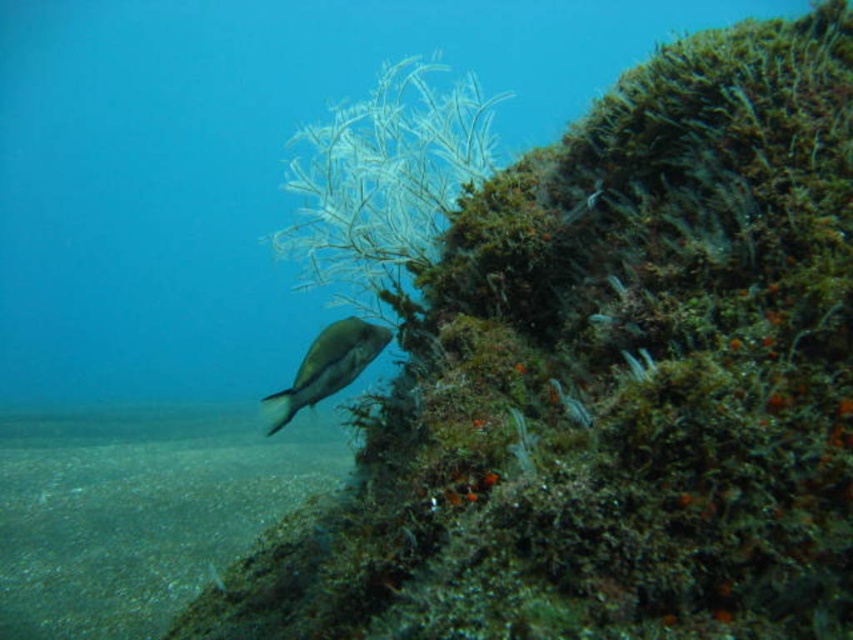
Question: Among these objects, which one is nearest to the camera?

Choices:
 (A) clear water at bottom
 (B) shiny silver fish at center

Answer: (B)

Question: Where is clear water at bottom located in relation to shiny silver fish at center in the image?

Choices:
 (A) left
 (B) right

Answer: (A)

Question: Which point is farther to the camera?

Choices:
 (A) clear water at bottom
 (B) shiny silver fish at center

Answer: (A)

Question: Which of the following is the closest to the observer?

Choices:
 (A) (103, 417)
 (B) (293, 380)

Answer: (B)

Question: Does clear water at bottom appear over shiny silver fish at center?

Choices:
 (A) yes
 (B) no

Answer: (B)

Question: Where is clear water at bottom located in relation to shiny silver fish at center in the image?

Choices:
 (A) left
 (B) right

Answer: (A)